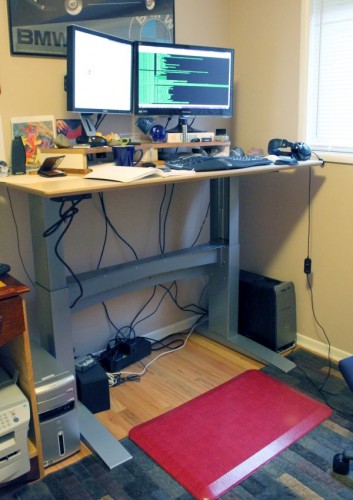
Find the location of a particular element. window with white closed miniblinds is located at coordinates (338, 60).